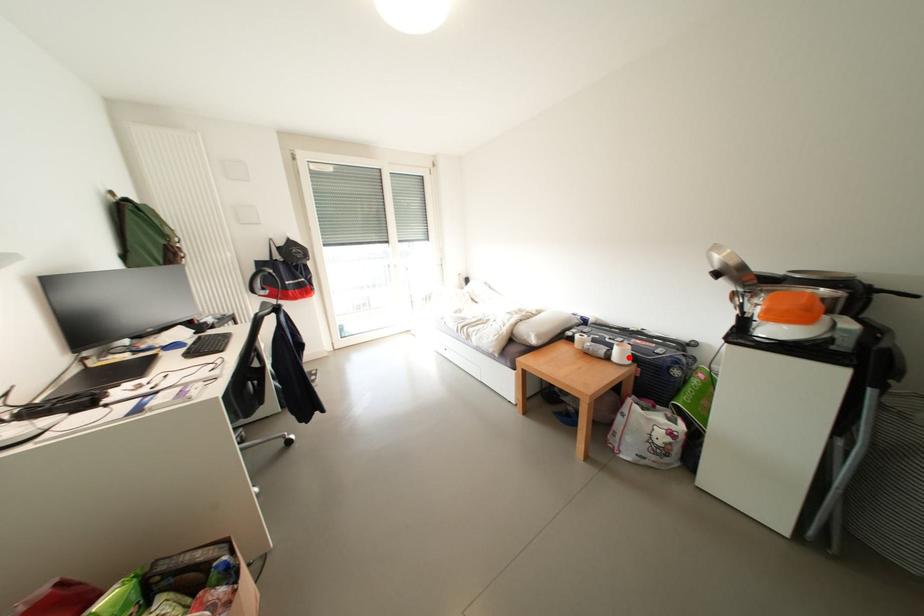
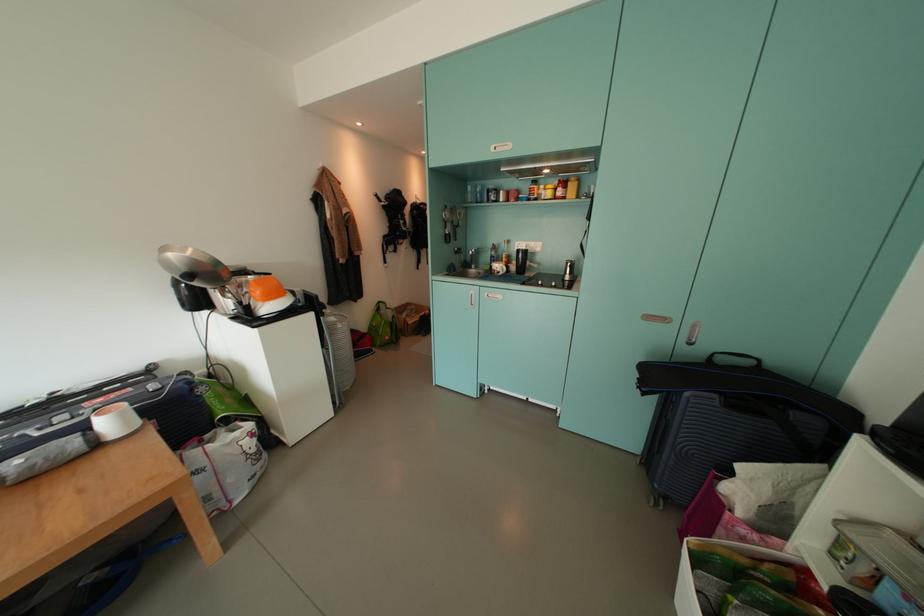
Locate, in the second image, the point that corresponds to the highlighted location in the first image.

(123, 426)